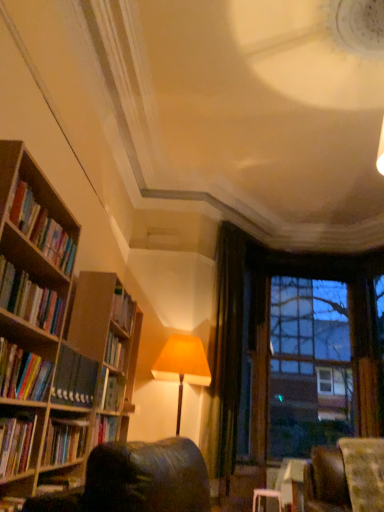
Image resolution: width=384 pixels, height=512 pixels. Describe the element at coordinates (16, 443) in the screenshot. I see `hardcover book at left, the fifth book in the top-to-bottom sequence` at that location.

What is the approximate width of hardcover books at left, which is the 2th book from top to bottom?

hardcover books at left, which is the 2th book from top to bottom, is 8.76 inches wide.

What do you see at coordinates (74, 379) in the screenshot?
I see `hardcover books at left, which is the fourth book from top to bottom` at bounding box center [74, 379].

The height and width of the screenshot is (512, 384). What do you see at coordinates (308, 366) in the screenshot?
I see `brown wooden window frame at upper right` at bounding box center [308, 366].

This screenshot has height=512, width=384. I want to click on hardcover book at left, which ranks as the 1th book in bottom-to-top order, so click(x=16, y=443).

Considering the relative positions of hardcover book at left, the fifth book in the top-to-bottom sequence, and velvet green swivel chair at lower right in the image provided, is hardcover book at left, the fifth book in the top-to-bottom sequence, behind velvet green swivel chair at lower right?

No, the depth of hardcover book at left, the fifth book in the top-to-bottom sequence, is less than that of velvet green swivel chair at lower right.

Can we say hardcover book at left, the fifth book in the top-to-bottom sequence, lies outside velvet green swivel chair at lower right?

hardcover book at left, the fifth book in the top-to-bottom sequence, is positioned outside velvet green swivel chair at lower right.

Considering the relative positions of hardcover book at left, which ranks as the 1th book in bottom-to-top order, and velvet green swivel chair at lower right in the image provided, is hardcover book at left, which ranks as the 1th book in bottom-to-top order, to the left or to the right of velvet green swivel chair at lower right?

Based on their positions, hardcover book at left, which ranks as the 1th book in bottom-to-top order, is located to the left of velvet green swivel chair at lower right.

In the scene shown: From a real-world perspective, which object stands above the other?

From a 3D spatial view, hardcover book at left, the fifth book in the top-to-bottom sequence, is above.

How many degrees apart are the facing directions of brown wooden window frame at upper right and matte yellow lampshade at center?

The facing directions of brown wooden window frame at upper right and matte yellow lampshade at center are 0.612 degrees apart.

Considering the sizes of objects brown wooden window frame at upper right and matte yellow lampshade at center in the image provided, who is thinner, brown wooden window frame at upper right or matte yellow lampshade at center?

With smaller width is brown wooden window frame at upper right.

Is brown wooden window frame at upper right not near matte yellow lampshade at center?

Indeed, brown wooden window frame at upper right is not near matte yellow lampshade at center.

Based on the photo, does brown wooden window frame at upper right come behind matte yellow lampshade at center?

Yes, brown wooden window frame at upper right is further from the camera.

Is matte yellow lampshade at center next to hardcover books at left, which appears as the first book when viewed from the top, and touching it?

They are not placed beside each other.

Is point (160, 367) farther from camera compared to point (47, 256)?

Yes, point (160, 367) is behind point (47, 256).

Consider the image. Between matte yellow lampshade at center and hardcover books at left, which appears as the first book when viewed from the top, which one is positioned behind?

matte yellow lampshade at center.

How distant is matte yellow lampshade at center from hardcover books at left, which appears as the first book when viewed from the top?

matte yellow lampshade at center is 2.20 meters away from hardcover books at left, which appears as the first book when viewed from the top.

Is velvet green swivel chair at lower right positioned far away from hardcover book at left, which ranks as the 1th book in bottom-to-top order?

Yes, velvet green swivel chair at lower right and hardcover book at left, which ranks as the 1th book in bottom-to-top order, are located far from each other.

Does velvet green swivel chair at lower right have a larger size compared to hardcover book at left, the fifth book in the top-to-bottom sequence?

Yes, velvet green swivel chair at lower right is bigger than hardcover book at left, the fifth book in the top-to-bottom sequence.

Can you confirm if velvet green swivel chair at lower right is thinner than hardcover book at left, which ranks as the 1th book in bottom-to-top order?

No.

From the image's perspective, relative to hardcover books at left, the second book from the bottom, is hardcover books at left, the 3th book positioned from the top, above or below?

hardcover books at left, the 3th book positioned from the top, is above hardcover books at left, the second book from the bottom.

Which book is the 2nd one when counting from the front of the hardcover books at left, which is the fourth book from top to bottom? Please provide its 2D coordinates.

[(23, 373)]

Which of these two, hardcover books at left, positioned as the third book in bottom-to-top order, or hardcover books at left, which is the fourth book from top to bottom, stands shorter?

hardcover books at left, positioned as the third book in bottom-to-top order.

Is hardcover books at left, the second book from the bottom, at the back of hardcover books at left, the 3th book positioned from the top?

No.

From a real-world perspective, does hardcover books at left, the 3th book positioned from the top, stand above velvet green swivel chair at lower right?

Yes, from a real-world perspective, hardcover books at left, the 3th book positioned from the top, is over velvet green swivel chair at lower right

Measure the distance from hardcover books at left, positioned as the third book in bottom-to-top order, to velvet green swivel chair at lower right.

The distance of hardcover books at left, positioned as the third book in bottom-to-top order, from velvet green swivel chair at lower right is 2.21 meters.

Is hardcover books at left, the 3th book positioned from the top, further to the viewer compared to velvet green swivel chair at lower right?

No, hardcover books at left, the 3th book positioned from the top, is closer to the camera.

Who is smaller, hardcover books at left, positioned as the third book in bottom-to-top order, or velvet green swivel chair at lower right?

hardcover books at left, positioned as the third book in bottom-to-top order.

Identify the location of window frame above the hardcover book at left, the fifth book in the top-to-bottom sequence (from a real-world perspective). The width and height of the screenshot is (384, 512). (308, 366).

Could you tell me if hardcover book at left, which ranks as the 1th book in bottom-to-top order, is facing brown wooden window frame at upper right?

No, hardcover book at left, which ranks as the 1th book in bottom-to-top order, is not facing towards brown wooden window frame at upper right.

Is hardcover book at left, which ranks as the 1th book in bottom-to-top order, completely or partially outside of brown wooden window frame at upper right?

Yes.

There is a velvet green swivel chair at lower right. Where is `the 1st book above it (from the image's perspective)`? the 1st book above it (from the image's perspective) is located at coordinates (16, 443).

The image size is (384, 512). I want to click on lamp in front of the brown wooden window frame at upper right, so 182,366.

Based on their spatial positions, is green velvet curtain at center or hardcover books at left, the second book from the bottom, further from hardcover books at left, the fourth book ordered from the bottom?

green velvet curtain at center is further to hardcover books at left, the fourth book ordered from the bottom.

Considering their positions, is velvet green swivel chair at lower right positioned closer to green velvet curtain at center than hardcover books at left, the 3th book positioned from the top?

Based on the image, velvet green swivel chair at lower right appears to be nearer to green velvet curtain at center.

Considering their positions, is hardcover books at left, the fifth book when ordered from bottom to top, positioned closer to hardcover book at left, the fifth book in the top-to-bottom sequence, than hardcover books at left, the second book from the bottom?

hardcover books at left, the second book from the bottom, lies closer to hardcover book at left, the fifth book in the top-to-bottom sequence, than the other object.

From the picture: When comparing their distances from green velvet curtain at center, does hardcover books at left, the fourth book ordered from the bottom, or hardcover books at left, the fifth book when ordered from bottom to top, seem closer?

hardcover books at left, the fifth book when ordered from bottom to top, lies closer to green velvet curtain at center than the other object.

Looking at this image, looking at the image, which one is located closer to hardcover books at left, which appears as the first book when viewed from the top, green velvet curtain at center or velvet green swivel chair at lower right?

velvet green swivel chair at lower right.

Looking at the image, which one is located further to hardcover book at left, the fifth book in the top-to-bottom sequence, hardcover books at left, which is the 2th book from top to bottom, or brown wooden window frame at upper right?

brown wooden window frame at upper right is positioned further to the anchor hardcover book at left, the fifth book in the top-to-bottom sequence.

From the image, which object appears to be nearer to matte yellow lampshade at center, hardcover books at left, which appears as the first book when viewed from the top, or velvet green swivel chair at lower right?

velvet green swivel chair at lower right lies closer to matte yellow lampshade at center than the other object.

From the image, which object appears to be nearer to hardcover books at left, which is the 2th book from top to bottom, brown wooden window frame at upper right or hardcover books at left, positioned as the third book in bottom-to-top order?

hardcover books at left, positioned as the third book in bottom-to-top order.

This screenshot has width=384, height=512. I want to click on swivel chair positioned between hardcover books at left, the fifth book when ordered from bottom to top, and green velvet curtain at center from near to far, so click(364, 472).

Find the location of `lamp located between hardcover books at left, positioned as the third book in bottom-to-top order, and green velvet curtain at center in the depth direction`. lamp located between hardcover books at left, positioned as the third book in bottom-to-top order, and green velvet curtain at center in the depth direction is located at coordinates (182, 366).

Find the location of a particular element. lamp between velvet green swivel chair at lower right and green velvet curtain at center from front to back is located at coordinates (182, 366).

The height and width of the screenshot is (512, 384). Find the location of `lamp between hardcover books at left, the 3th book positioned from the top, and brown wooden window frame at upper right from front to back`. lamp between hardcover books at left, the 3th book positioned from the top, and brown wooden window frame at upper right from front to back is located at coordinates (182, 366).